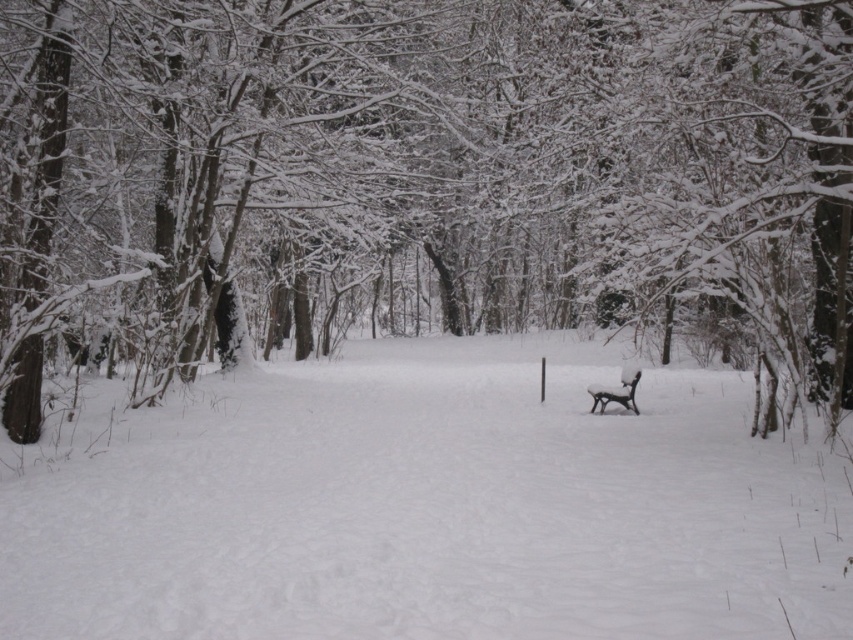
Question: Which is nearer to the white fluffy snow at center?

Choices:
 (A) snow-covered tree at center
 (B) snow-covered wooden bench at center

Answer: (B)

Question: Is snow-covered tree at center positioned in front of snow-covered wooden bench at center?

Choices:
 (A) no
 (B) yes

Answer: (B)

Question: Can you confirm if snow-covered tree at center is positioned below snow-covered wooden bench at center?

Choices:
 (A) no
 (B) yes

Answer: (A)

Question: Which of these objects is positioned farthest from the snow-covered wooden bench at center?

Choices:
 (A) white fluffy snow at center
 (B) snow-covered tree at center

Answer: (B)

Question: Is snow-covered tree at center smaller than white fluffy snow at center?

Choices:
 (A) yes
 (B) no

Answer: (B)

Question: Based on their relative distances, which object is farther from the white fluffy snow at center?

Choices:
 (A) snow-covered tree at center
 (B) snow-covered wooden bench at center

Answer: (A)